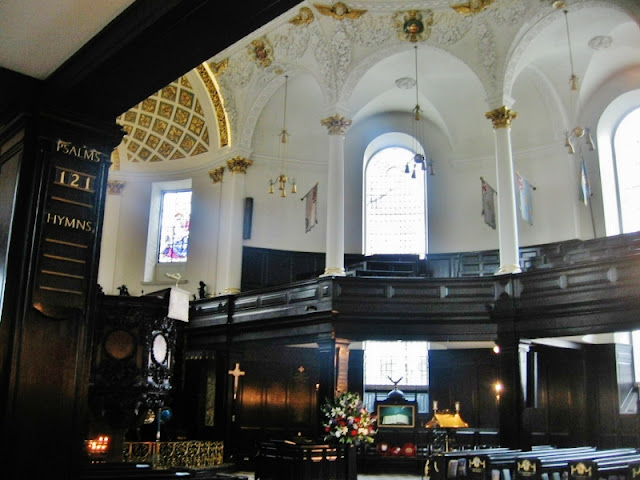
You are a GUI agent. You are given a task and a screenshot of the screen. Output one action in this format:
    pyautogui.click(x=<x>, y=<y>)
    Task: Click on the bouquet of flowers
    
    Given the screenshot: What is the action you would take?
    pyautogui.click(x=349, y=416)